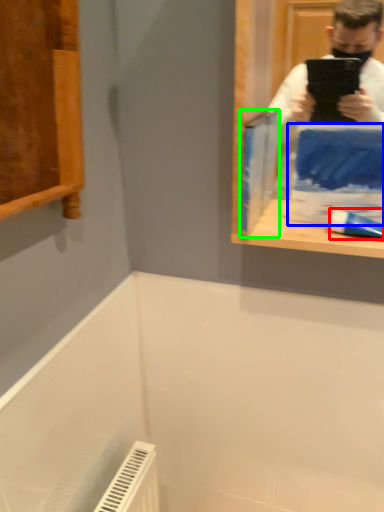
Question: Based on their relative distances, which object is farther from toothpaste (highlighted by a red box)? Choose from paperback book (highlighted by a blue box) and paperback book (highlighted by a green box).

Choices:
 (A) paperback book
 (B) paperback book

Answer: (B)